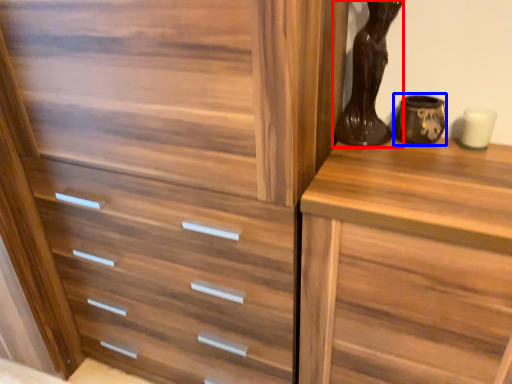
Question: Which object appears closest to the camera in this image, vase (highlighted by a red box) or vase (highlighted by a blue box)?

Choices:
 (A) vase
 (B) vase

Answer: (A)